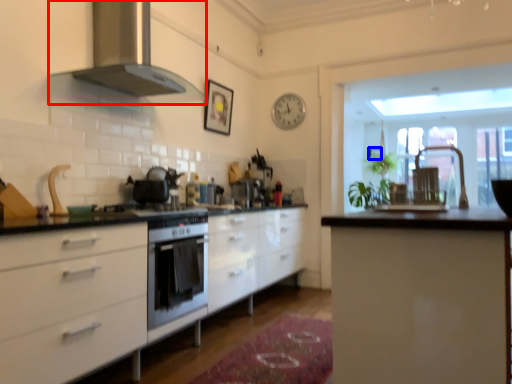
Question: Which of the following is the farthest to the observer, home appliance (highlighted by a red box) or picture frame (highlighted by a blue box)?

Choices:
 (A) home appliance
 (B) picture frame

Answer: (B)